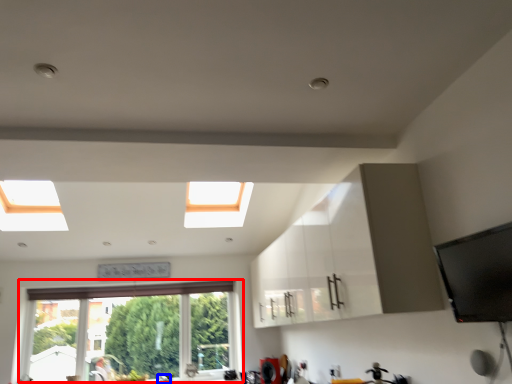
Question: Among these objects, which one is nearest to the camera, window (highlighted by a red box) or faucet (highlighted by a blue box)?

Choices:
 (A) window
 (B) faucet

Answer: (B)